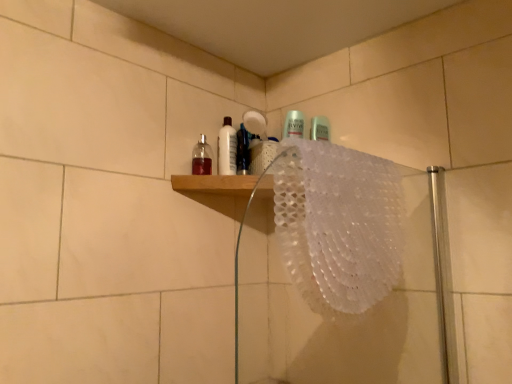
Question: In which direction should I rotate to look at semi-transparent plastic mouthwash at upper center, which is the first mouthwash from right to left?

Choices:
 (A) left
 (B) right

Answer: (A)

Question: Considering the relative sizes of translucent glass bottle at upper center, which is the 3th mouthwash from right to left, and white lace doily at upper center in the image provided, is translucent glass bottle at upper center, which is the 3th mouthwash from right to left, thinner than white lace doily at upper center?

Choices:
 (A) yes
 (B) no

Answer: (A)

Question: Can you confirm if translucent glass bottle at upper center, positioned as the first mouthwash in left-to-right order, is wider than white lace doily at upper center?

Choices:
 (A) no
 (B) yes

Answer: (A)

Question: Considering the relative positions of translucent glass bottle at upper center, which is the 3th mouthwash from right to left, and white lace doily at upper center in the image provided, is translucent glass bottle at upper center, which is the 3th mouthwash from right to left, to the right of white lace doily at upper center from the viewer's perspective?

Choices:
 (A) no
 (B) yes

Answer: (A)

Question: Is translucent glass bottle at upper center, which is the 3th mouthwash from right to left, oriented away from white lace doily at upper center?

Choices:
 (A) yes
 (B) no

Answer: (B)

Question: Is translucent glass bottle at upper center, which is the 3th mouthwash from right to left, positioned far away from white lace doily at upper center?

Choices:
 (A) yes
 (B) no

Answer: (B)

Question: From a real-world perspective, is translucent glass bottle at upper center, which is the 3th mouthwash from right to left, under white lace doily at upper center?

Choices:
 (A) no
 (B) yes

Answer: (A)

Question: From the image's perspective, is white lace doily at upper center located above semi-transparent plastic mouthwash at upper center, arranged as the 3th mouthwash when viewed from the left?

Choices:
 (A) no
 (B) yes

Answer: (A)

Question: Is white lace doily at upper center not within semi-transparent plastic mouthwash at upper center, which is the first mouthwash from right to left?

Choices:
 (A) no
 (B) yes

Answer: (B)

Question: Can semi-transparent plastic mouthwash at upper center, arranged as the 3th mouthwash when viewed from the left, be found inside white lace doily at upper center?

Choices:
 (A) yes
 (B) no

Answer: (B)

Question: Is white lace doily at upper center far from semi-transparent plastic mouthwash at upper center, which is the first mouthwash from right to left?

Choices:
 (A) yes
 (B) no

Answer: (B)

Question: Is white lace doily at upper center closer to the viewer compared to semi-transparent plastic mouthwash at upper center, which is the first mouthwash from right to left?

Choices:
 (A) no
 (B) yes

Answer: (B)

Question: Does white lace doily at upper center have a larger size compared to semi-transparent plastic mouthwash at upper center, which is the first mouthwash from right to left?

Choices:
 (A) no
 (B) yes

Answer: (B)

Question: Can semi-transparent plastic mouthwash at upper center, which is the first mouthwash from right to left, be found inside white textured bath towel at upper right?

Choices:
 (A) yes
 (B) no

Answer: (B)